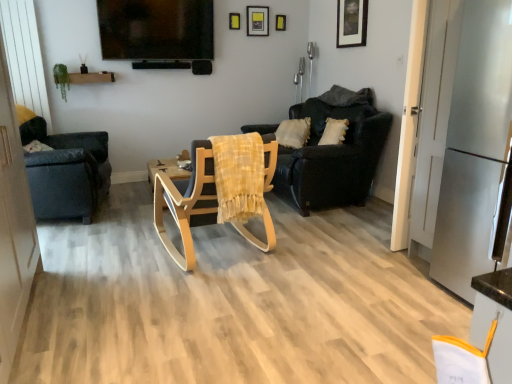
Question: In which direction should I rotate to look at matte yellow picture frame at upper center, which is the 1th picture frame in back-to-front order?

Choices:
 (A) right
 (B) left

Answer: (A)

Question: Is matte yellow picture frame at upper center, the 4th picture frame positioned from the front, facing away from yellow matte picture frame at upper center, which ranks as the first picture frame in left-to-right order?

Choices:
 (A) no
 (B) yes

Answer: (A)

Question: Is matte yellow picture frame at upper center, which is the 1th picture frame in back-to-front order, touching yellow matte picture frame at upper center, which ranks as the first picture frame in left-to-right order?

Choices:
 (A) yes
 (B) no

Answer: (B)

Question: From a real-world perspective, is matte yellow picture frame at upper center, which is the 1th picture frame in back-to-front order, physically below yellow matte picture frame at upper center, which appears as the fourth picture frame when viewed from the right?

Choices:
 (A) no
 (B) yes

Answer: (B)

Question: Can you confirm if matte yellow picture frame at upper center, which is the 1th picture frame in back-to-front order, is positioned to the left of yellow matte picture frame at upper center, the 2th picture frame when ordered from front to back?

Choices:
 (A) no
 (B) yes

Answer: (A)

Question: Considering the relative sizes of matte yellow picture frame at upper center, which is the 1th picture frame in back-to-front order, and yellow matte picture frame at upper center, positioned as the third picture frame in back-to-front order, in the image provided, is matte yellow picture frame at upper center, which is the 1th picture frame in back-to-front order, taller than yellow matte picture frame at upper center, positioned as the third picture frame in back-to-front order,?

Choices:
 (A) no
 (B) yes

Answer: (B)

Question: Is matte yellow picture frame at upper center, which is the 1th picture frame in back-to-front order, at the right side of yellow matte picture frame at upper center, the 2th picture frame when ordered from front to back?

Choices:
 (A) no
 (B) yes

Answer: (B)

Question: From a real-world perspective, is yellow matte picture frame at upper center, positioned as the third picture frame in back-to-front order, under dark gray fabric chair at left, the third chair positioned from the right?

Choices:
 (A) yes
 (B) no

Answer: (B)

Question: Considering the relative positions of yellow matte picture frame at upper center, the 2th picture frame when ordered from front to back, and dark gray fabric chair at left, the third chair positioned from the right, in the image provided, is yellow matte picture frame at upper center, the 2th picture frame when ordered from front to back, to the right of dark gray fabric chair at left, the third chair positioned from the right, from the viewer's perspective?

Choices:
 (A) no
 (B) yes

Answer: (B)

Question: Is yellow matte picture frame at upper center, positioned as the third picture frame in back-to-front order, bigger than dark gray fabric chair at left, the third chair positioned from the right?

Choices:
 (A) no
 (B) yes

Answer: (A)

Question: From the image's perspective, is yellow matte picture frame at upper center, positioned as the third picture frame in back-to-front order, above dark gray fabric chair at left, the third chair positioned from the right?

Choices:
 (A) no
 (B) yes

Answer: (B)

Question: Considering the relative sizes of yellow matte picture frame at upper center, which appears as the fourth picture frame when viewed from the right, and dark gray fabric chair at left, placed as the 1th chair when sorted from left to right, in the image provided, is yellow matte picture frame at upper center, which appears as the fourth picture frame when viewed from the right, shorter than dark gray fabric chair at left, placed as the 1th chair when sorted from left to right,?

Choices:
 (A) yes
 (B) no

Answer: (A)

Question: Is yellow matte picture frame at upper center, which ranks as the first picture frame in left-to-right order, positioned in front of dark gray fabric chair at left, placed as the 1th chair when sorted from left to right?

Choices:
 (A) no
 (B) yes

Answer: (A)

Question: Is dark gray fabric chair at left, placed as the 1th chair when sorted from left to right, shorter than wooden rocking chair at center, which appears as the second chair when viewed from the left?

Choices:
 (A) yes
 (B) no

Answer: (B)